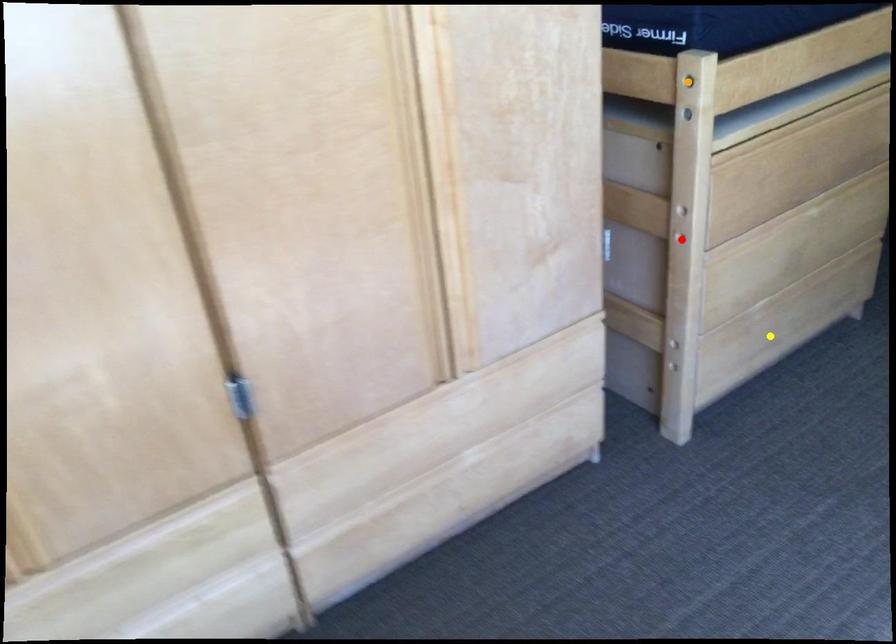
Order these from nearest to farthest:
- yellow point
- red point
- orange point

orange point < red point < yellow point